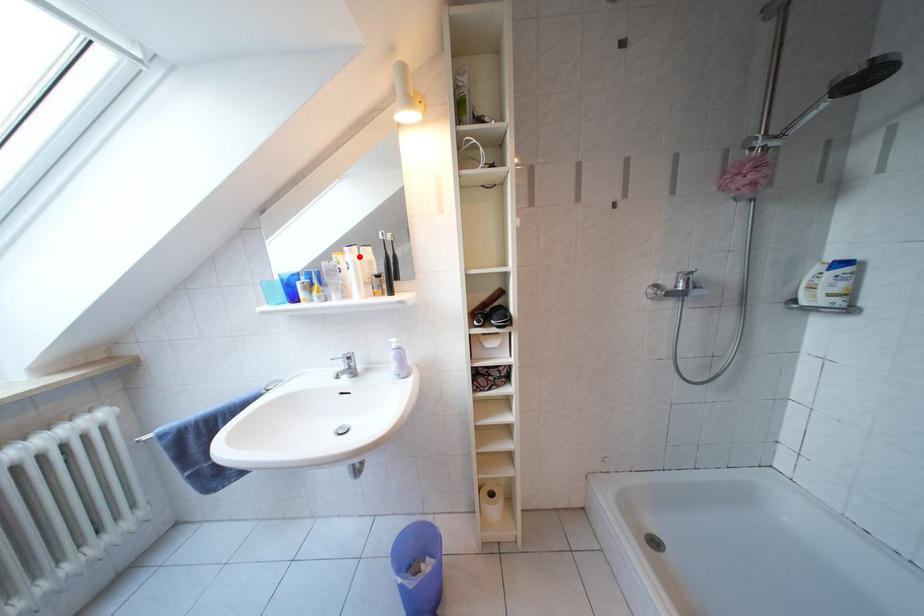
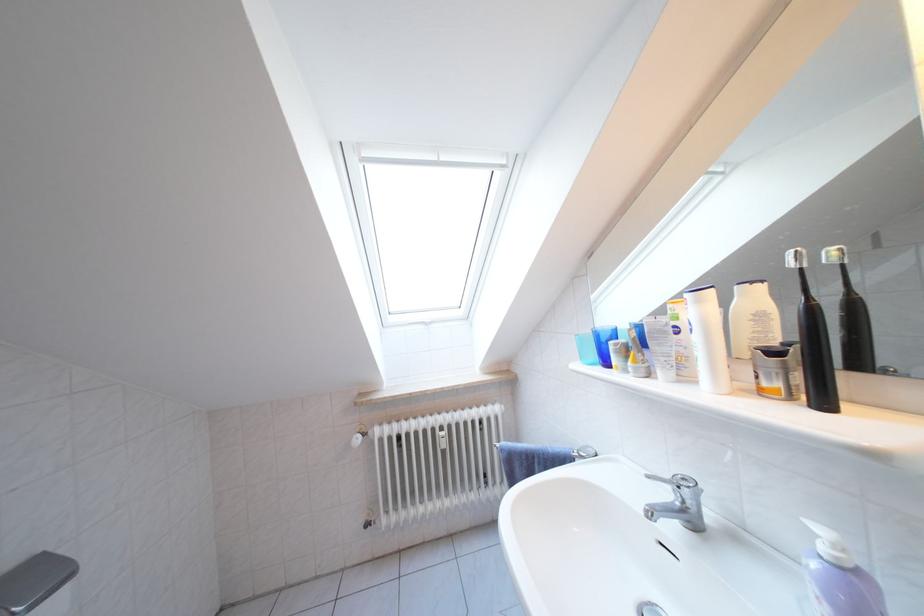
Find the pixel in the second image that matches the highlighted location in the first image.

(708, 306)